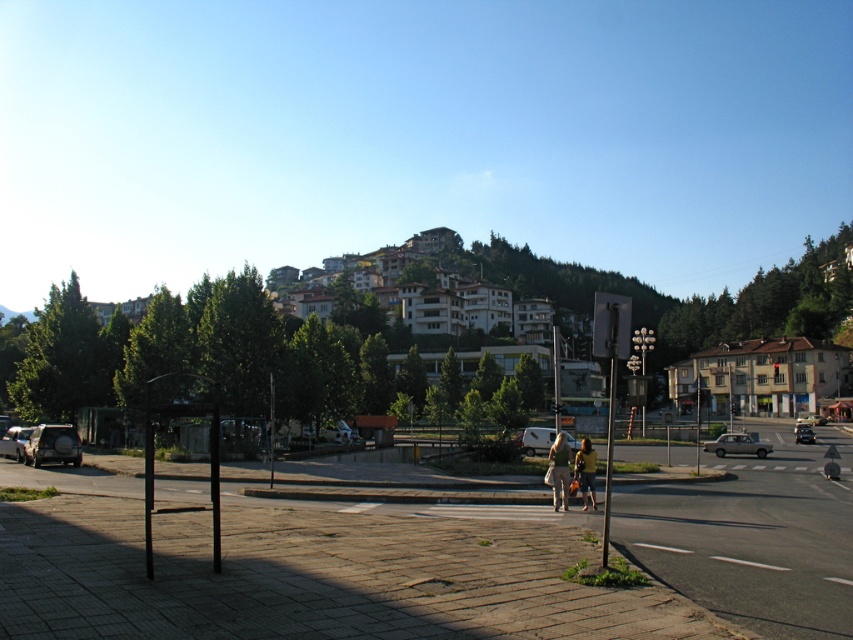
Does matte silver suv at lower left appear under silver metallic van at center?

No, matte silver suv at lower left is not below silver metallic van at center.

Based on the photo, is matte silver suv at lower left to the right of silver metallic van at center from the viewer's perspective?

No, matte silver suv at lower left is not to the right of silver metallic van at center.

Is point (54, 451) positioned behind point (544, 444)?

No, (54, 451) is closer to viewer.

This screenshot has height=640, width=853. What are the coordinates of `matte silver suv at lower left` in the screenshot? It's located at tap(53, 445).

Looking at this image, who is taller, metallic silver suv at left or metallic silver sedan at center-right?

With more height is metallic silver suv at left.

Is metallic silver suv at left shorter than metallic silver sedan at center-right?

No, metallic silver suv at left is not shorter than metallic silver sedan at center-right.

Where is `metallic silver suv at left`? The width and height of the screenshot is (853, 640). metallic silver suv at left is located at coordinates (15, 442).

Identify the location of metallic silver suv at left. The height and width of the screenshot is (640, 853). (15, 442).

Does green fabric bag at center have a smaller size compared to metallic silver suv at left?

Yes, green fabric bag at center is smaller than metallic silver suv at left.

You are a GUI agent. You are given a task and a screenshot of the screen. Output one action in this format:
    pyautogui.click(x=<x>, y=<y>)
    Task: Click on the green fabric bag at center
    The width and height of the screenshot is (853, 640).
    Given the screenshot: What is the action you would take?
    pyautogui.click(x=560, y=470)